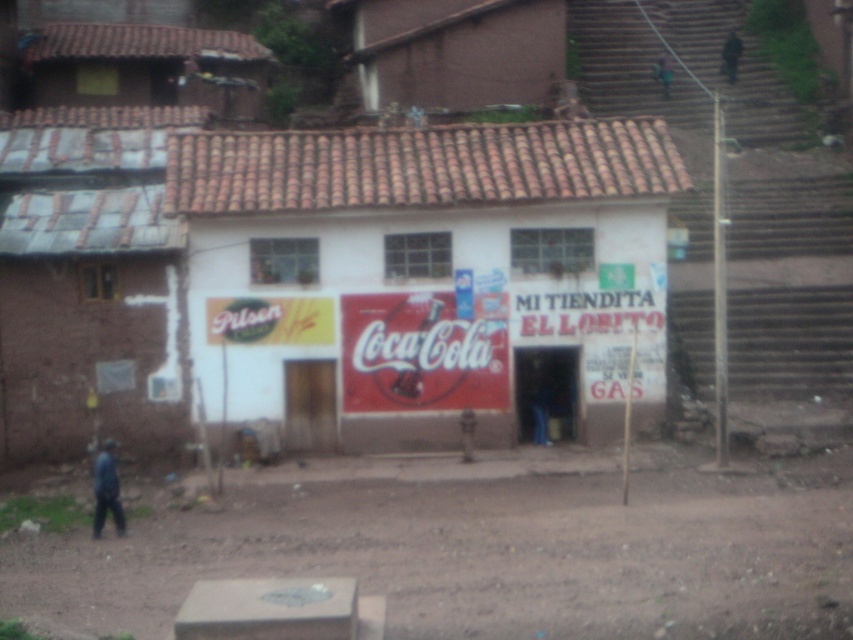
Question: Is brown dirt field at lower center bigger than dark blue fabric at lower left?

Choices:
 (A) no
 (B) yes

Answer: (B)

Question: Which point appears closest to the camera in this image?

Choices:
 (A) (100, 467)
 (B) (485, 353)

Answer: (A)

Question: Among these objects, which one is nearest to the camera?

Choices:
 (A) dark blue fabric at lower left
 (B) brown dirt field at lower center
 (C) white painted wall at center

Answer: (B)

Question: Is white painted wall at center positioned at the back of brown dirt field at lower center?

Choices:
 (A) no
 (B) yes

Answer: (B)

Question: From the image, what is the correct spatial relationship of white painted wall at center in relation to dark blue fabric at lower left?

Choices:
 (A) above
 (B) below

Answer: (A)

Question: Which object appears closest to the camera in this image?

Choices:
 (A) brown dirt field at lower center
 (B) dark blue fabric at lower left
 (C) white painted wall at center

Answer: (A)